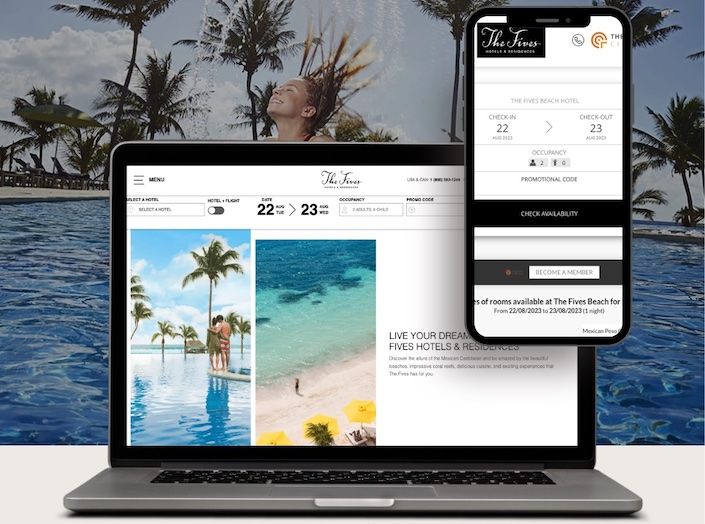
Identify the location of laptop screen. This screenshot has height=524, width=705. (381, 174).